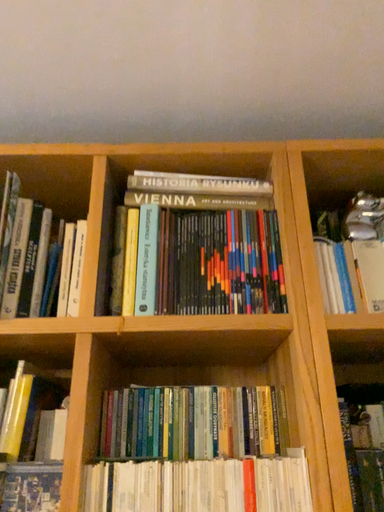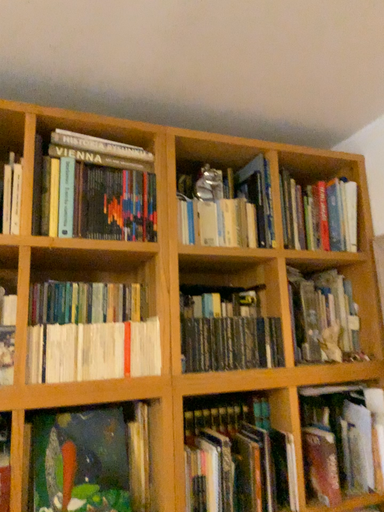
Question: Which way did the camera rotate in the video?

Choices:
 (A) rotated upward
 (B) rotated downward

Answer: (B)